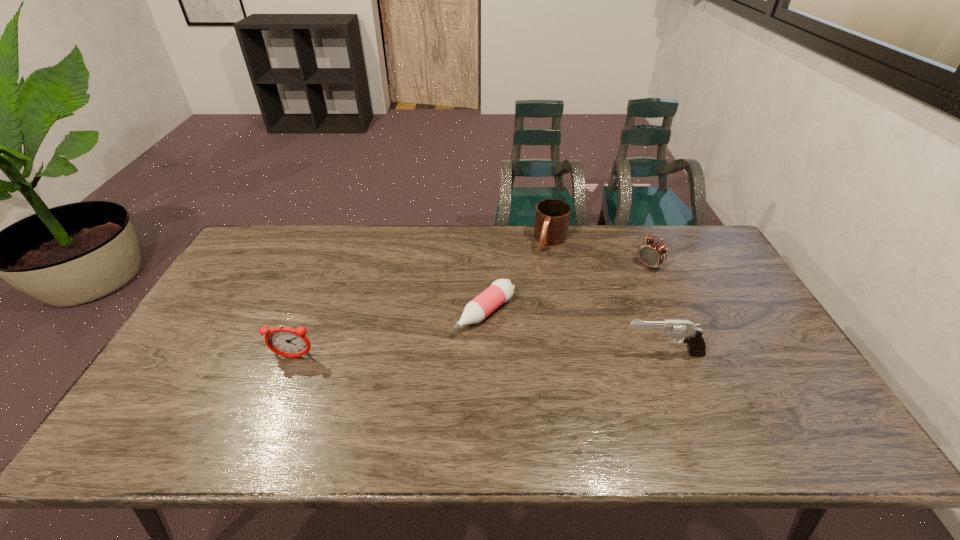
You are a GUI agent. You are given a task and a screenshot of the screen. Output one action in this format:
    pyautogui.click(x=<x>, y=<y>)
    Task: Click on the vacant space that's between the right alarm clock and the third nearest object
    This screenshot has height=540, width=960.
    Given the screenshot: What is the action you would take?
    pyautogui.click(x=567, y=289)

The width and height of the screenshot is (960, 540). Identify the location of vacant region between the fourth nearest object and the gun. (656, 309).

Find the location of a particular element. The height and width of the screenshot is (540, 960). vacant point located between the left alarm clock and the farthest object is located at coordinates (x=422, y=299).

The height and width of the screenshot is (540, 960). Identify the location of empty space between the gun and the leftmost object. (478, 355).

The width and height of the screenshot is (960, 540). What are the coordinates of `free space between the farthest object and the leftmost object` in the screenshot? It's located at (422, 299).

Identify the location of the closest object to the farthest object. This screenshot has height=540, width=960. (501, 290).

Locate which object ranks fourth in proximity to the shortest object. Please provide its 2D coordinates. Your answer should be formatted as a tuple, i.e. [(x, y)], where the tuple contains the x and y coordinates of a point satisfying the conditions above.

[(652, 253)]

Where is `free space that satisfies the following two spatial constraints: 1. on the front side of the mug; 2. at the muzzle of the gun`? free space that satisfies the following two spatial constraints: 1. on the front side of the mug; 2. at the muzzle of the gun is located at coordinates (574, 353).

Locate an element on the screen. This screenshot has height=540, width=960. blank space that satisfies the following two spatial constraints: 1. on the front side of the third object from right to left; 2. on the right side of the farther alarm clock is located at coordinates (556, 266).

Locate an element on the screen. The height and width of the screenshot is (540, 960). free spot that satisfies the following two spatial constraints: 1. on the front side of the bottle; 2. at the muzzle of the gun is located at coordinates (486, 353).